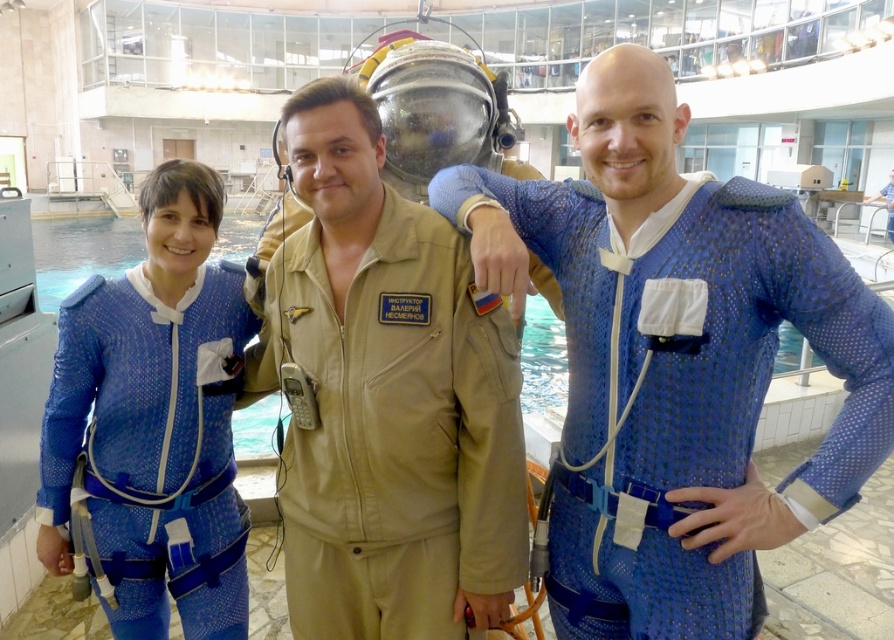
You are a safety officer inspecting the indoor swimming pool facility. You notice two individuals wearing blue suits. The blue textured jumpsuit at center and the blue mesh suit at left. Which one is closer to you?

The blue textured jumpsuit at center is closer to you because it is in front of the blue mesh suit at left.

You are a safety officer in the facility. You need to ensure that the distance between the tan fabric jumpsuit at center and the camera is at least 3 meters to comply with safety regulations. Is the current distance compliant?

The tan fabric jumpsuit at center and camera are 2.64 meters apart from each other, which is less than the required 3 meters. The current distance does not comply with safety regulations.